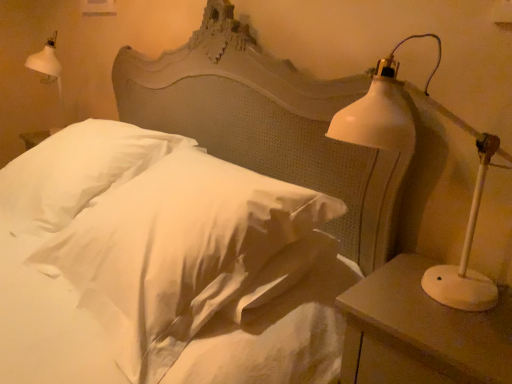
Locate an element on the screen. This screenshot has height=384, width=512. white matte lamp at right is located at coordinates (412, 149).

I want to click on white matte lamp at right, so [x=412, y=149].

Is white satin pillow at center, the first pillow when ordered from right to left, looking in the opposite direction of white matte lamp at right?

white satin pillow at center, the first pillow when ordered from right to left, is not turned away from white matte lamp at right.

Considering the positions of objects white satin pillow at center, which is the 2th pillow from left to right, and white matte lamp at right in the image provided, who is more to the left, white satin pillow at center, which is the 2th pillow from left to right, or white matte lamp at right?

From the viewer's perspective, white satin pillow at center, which is the 2th pillow from left to right, appears more on the left side.

Is point (185, 200) farther from viewer compared to point (505, 155)?

Yes, point (185, 200) is behind point (505, 155).

Is white matte lamp at right with white soft pillow at center, the first pillow from the left?

No, white matte lamp at right is not touching white soft pillow at center, the first pillow from the left.

From the image's perspective, which one is positioned higher, white matte lamp at right or white soft pillow at center, the first pillow from the left?

white soft pillow at center, the first pillow from the left, appears higher in the image.

Is white soft pillow at center, the 2th pillow in the right-to-left sequence, thinner than white satin pillow at center, which is the 2th pillow from left to right?

Yes, white soft pillow at center, the 2th pillow in the right-to-left sequence, is thinner than white satin pillow at center, which is the 2th pillow from left to right.

Could you measure the distance between white soft pillow at center, the first pillow from the left, and white satin pillow at center, which is the 2th pillow from left to right?

white soft pillow at center, the first pillow from the left, and white satin pillow at center, which is the 2th pillow from left to right, are 21.73 inches apart from each other.

Between white soft pillow at center, the 2th pillow in the right-to-left sequence, and white satin pillow at center, the first pillow when ordered from right to left, which one has smaller size?

white satin pillow at center, the first pillow when ordered from right to left, is smaller.

At what (x,y) coordinates should I click in order to perform the action: click on pillow above the white satin pillow at center, which is the 2th pillow from left to right (from the image's perspective). Please return your answer as a coordinate pair (x, y). Looking at the image, I should click on (76, 171).

Is white satin pillow at center, the first pillow when ordered from right to left, facing towards white matte nightstand at right?

No, white satin pillow at center, the first pillow when ordered from right to left, does not turn towards white matte nightstand at right.

Who is shorter, white satin pillow at center, the first pillow when ordered from right to left, or white matte nightstand at right?

white satin pillow at center, the first pillow when ordered from right to left.

From the image's perspective, which one is positioned lower, white satin pillow at center, the first pillow when ordered from right to left, or white matte nightstand at right?

From the image's view, white matte nightstand at right is below.

Which object is wider, white matte lamp at right or white satin pillow at center, the first pillow when ordered from right to left?

white satin pillow at center, the first pillow when ordered from right to left.

How many degrees apart are the facing directions of white matte lamp at right and white satin pillow at center, the first pillow when ordered from right to left?

white matte lamp at right and white satin pillow at center, the first pillow when ordered from right to left, are facing 0.64 degrees away from each other.

Choose the correct answer: Is white matte lamp at right inside white satin pillow at center, which is the 2th pillow from left to right, or outside it?

The correct answer is: outside.

Which is more to the left, white matte lamp at right or white satin pillow at center, the first pillow when ordered from right to left?

Positioned to the left is white satin pillow at center, the first pillow when ordered from right to left.

Would you say white matte nightstand at right is a long distance from white matte lamp at right?

No, white matte nightstand at right is not far from white matte lamp at right.

From their relative heights in the image, would you say white matte nightstand at right is taller or shorter than white matte lamp at right?

In the image, white matte nightstand at right appears to be shorter than white matte lamp at right.

Is white matte nightstand at right looking in the opposite direction of white matte lamp at right?

No, white matte lamp at right is not at the back of white matte nightstand at right.

From a real-world perspective, is white matte nightstand at right positioned under white matte lamp at right based on gravity?

Indeed, from a real-world perspective, white matte nightstand at right is positioned beneath white matte lamp at right.

From a real-world perspective, is white matte nightstand at right located beneath white satin pillow at center, which is the 2th pillow from left to right?

Yes, from a real-world perspective, white matte nightstand at right is below white satin pillow at center, which is the 2th pillow from left to right.

The width and height of the screenshot is (512, 384). What are the coordinates of `pillow in front of the white matte nightstand at right` in the screenshot? It's located at (209, 274).

Between white matte nightstand at right and white satin pillow at center, which is the 2th pillow from left to right, which one is positioned behind?

white matte nightstand at right.

Looking at the image, does white matte nightstand at right seem bigger or smaller compared to white satin pillow at center, the first pillow when ordered from right to left?

Considering their sizes, white matte nightstand at right takes up less space than white satin pillow at center, the first pillow when ordered from right to left.

In the image, there is a white satin pillow at center, the first pillow when ordered from right to left. In order to click on lamp above it (from the image's perspective) in this screenshot , I will do `click(412, 149)`.

From a real-world perspective, which pillow is the 2nd one underneath the white matte lamp at right? Please provide its 2D coordinates.

[(76, 171)]

Based on their spatial positions, is white soft pillow at center, the 2th pillow in the right-to-left sequence, or white matte lamp at right further from white satin pillow at center, which is the 2th pillow from left to right?

white soft pillow at center, the 2th pillow in the right-to-left sequence, is positioned further to the anchor white satin pillow at center, which is the 2th pillow from left to right.

Considering their positions, is white soft pillow at center, the 2th pillow in the right-to-left sequence, positioned further to white satin pillow at center, which is the 2th pillow from left to right, than white matte nightstand at right?

white soft pillow at center, the 2th pillow in the right-to-left sequence, lies further to white satin pillow at center, which is the 2th pillow from left to right, than the other object.

Based on their spatial positions, is white satin pillow at center, the first pillow when ordered from right to left, or white matte nightstand at right further from white soft pillow at center, the 2th pillow in the right-to-left sequence?

Based on the image, white matte nightstand at right appears to be further to white soft pillow at center, the 2th pillow in the right-to-left sequence.

Based on their spatial positions, is white matte lamp at right or white satin pillow at center, the first pillow when ordered from right to left, further from white soft pillow at center, the first pillow from the left?

The object further to white soft pillow at center, the first pillow from the left, is white matte lamp at right.

Which object lies further to the anchor point white matte lamp at right, white matte nightstand at right or white satin pillow at center, the first pillow when ordered from right to left?

white satin pillow at center, the first pillow when ordered from right to left.

Based on the photo, when comparing their distances from white satin pillow at center, the first pillow when ordered from right to left, does white matte nightstand at right or white matte lamp at right seem closer?

white matte nightstand at right.

From the image, which object appears to be farther from white matte nightstand at right, white soft pillow at center, the 2th pillow in the right-to-left sequence, or white satin pillow at center, the first pillow when ordered from right to left?

white soft pillow at center, the 2th pillow in the right-to-left sequence, is positioned further to the anchor white matte nightstand at right.

When comparing their distances from white satin pillow at center, which is the 2th pillow from left to right, does white matte lamp at right or white soft pillow at center, the 2th pillow in the right-to-left sequence, seem closer?

Based on the image, white matte lamp at right appears to be nearer to white satin pillow at center, which is the 2th pillow from left to right.

Locate an element on the screen. pillow between white soft pillow at center, the first pillow from the left, and white matte lamp at right is located at coordinates (209, 274).

I want to click on lamp situated between white satin pillow at center, which is the 2th pillow from left to right, and white matte nightstand at right from left to right, so click(412, 149).

Find the location of `pillow located between white soft pillow at center, the 2th pillow in the right-to-left sequence, and white matte nightstand at right in the left-right direction`. pillow located between white soft pillow at center, the 2th pillow in the right-to-left sequence, and white matte nightstand at right in the left-right direction is located at coordinates (209, 274).

Find the location of a particular element. The width and height of the screenshot is (512, 384). lamp between white soft pillow at center, the first pillow from the left, and white matte nightstand at right, in the horizontal direction is located at coordinates (412, 149).